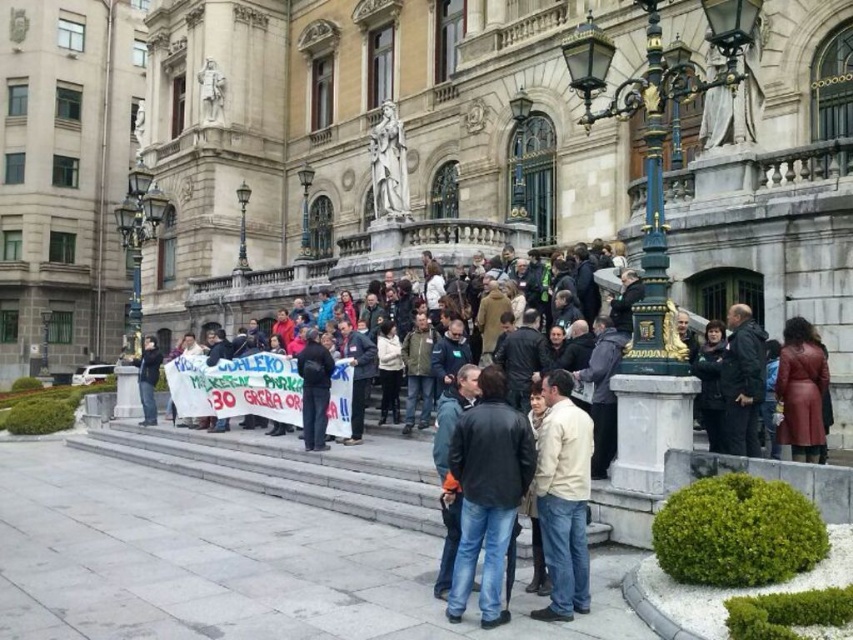
Does point (796, 346) come in front of point (148, 358)?

Yes.

Does leather coat at center have a lesser width compared to jeans at lower left?

Correct, leather coat at center's width is less than jeans at lower left's.

Who is more forward, (799, 384) or (149, 376)?

Point (799, 384) is more forward.

The image size is (853, 640). What are the coordinates of `leather coat at center` in the screenshot? It's located at (801, 390).

Between dark blue leather jacket at center and jeans at lower left, which one is positioned higher?

Positioned higher is jeans at lower left.

Between point (486, 528) and point (154, 416), which one is positioned in front?

Point (486, 528) is in front.

The height and width of the screenshot is (640, 853). Identify the location of dark blue leather jacket at center. (488, 493).

Is dark blue leather jacket at center closer to the viewer compared to light brown leather jacket at center?

Yes.

Is dark blue leather jacket at center positioned at the back of light brown leather jacket at center?

No.

Find the location of a particular element. dark blue leather jacket at center is located at coordinates (488, 493).